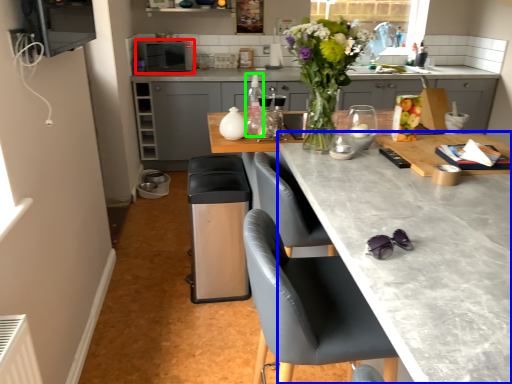
Question: Based on their relative distances, which object is nearer to kitchen appliance (highlighted by a red box)? Choose from countertop (highlighted by a blue box) and bottle (highlighted by a green box).

Choices:
 (A) countertop
 (B) bottle

Answer: (B)